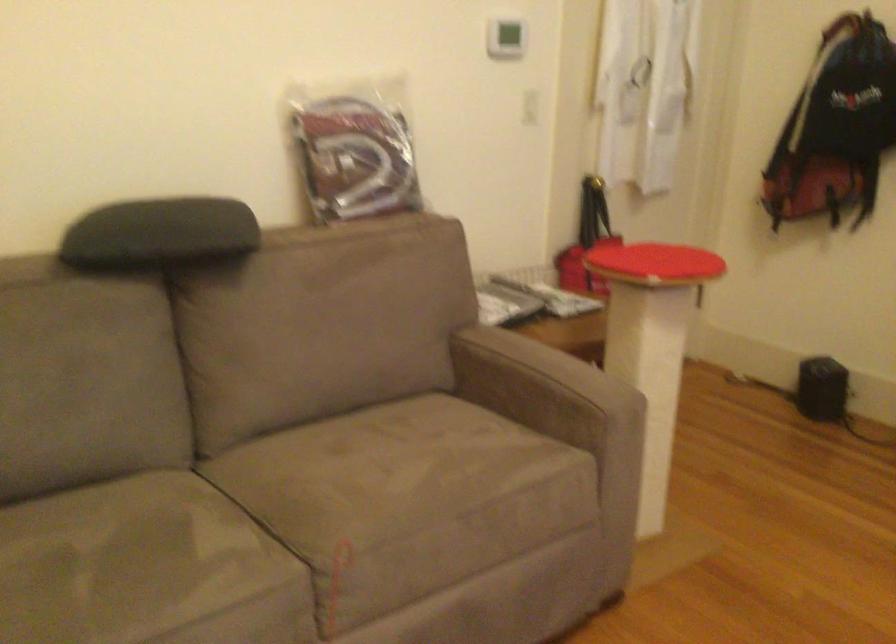
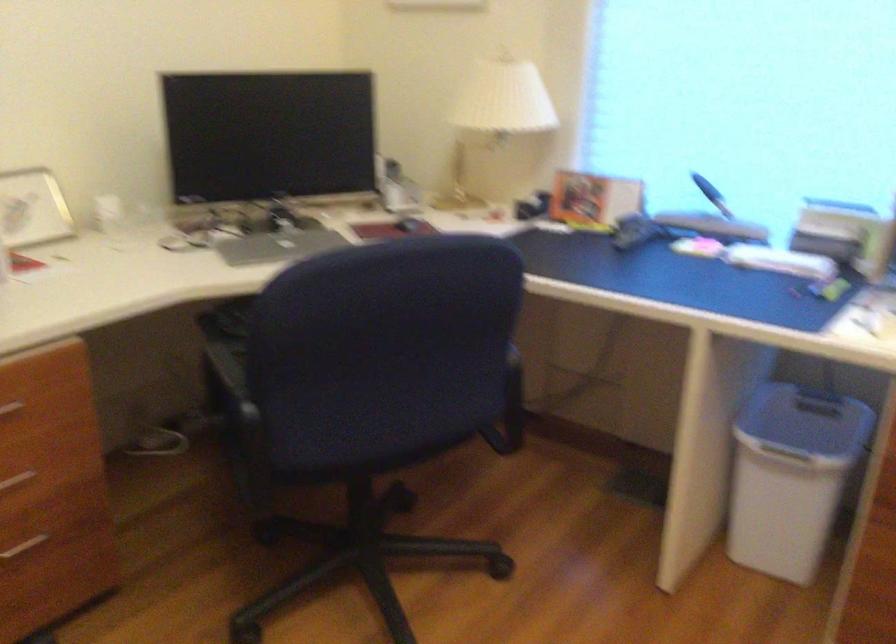
First-person continuous shooting, in which direction is the camera rotating?

The camera's rotation is toward right-down.